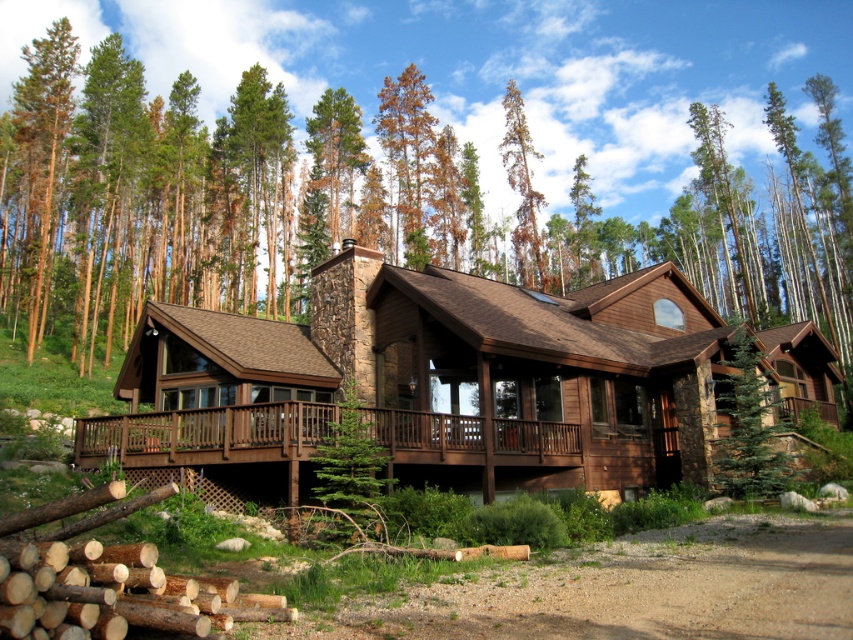
Can you confirm if brown wood cabin at center is wider than brown bark tree at upper center?

Yes.

Is brown wood cabin at center above brown bark tree at upper center?

No.

The width and height of the screenshot is (853, 640). What do you see at coordinates (432, 381) in the screenshot?
I see `brown wood cabin at center` at bounding box center [432, 381].

Identify the location of brown wood cabin at center. Image resolution: width=853 pixels, height=640 pixels. click(x=432, y=381).

Is brown wood porch at lower center further to the viewer compared to natural brown wood at lower left?

Yes, it is.

Is brown wood porch at lower center to the left of natural brown wood at lower left from the viewer's perspective?

Yes, brown wood porch at lower center is to the left of natural brown wood at lower left.

Who is more distant from viewer, (569, 429) or (189, 621)?

Positioned behind is point (569, 429).

Locate an element on the screen. The width and height of the screenshot is (853, 640). brown wood porch at lower center is located at coordinates (206, 435).

Which is in front, point (689, 225) or point (59, 113)?

Positioned in front is point (59, 113).

Is green wood tree at center thinner than brown wood tree at left?

No.

Is point (399, 179) positioned after point (30, 104)?

Yes, it is.

Where is `green wood tree at center`? The width and height of the screenshot is (853, 640). green wood tree at center is located at coordinates (212, 195).